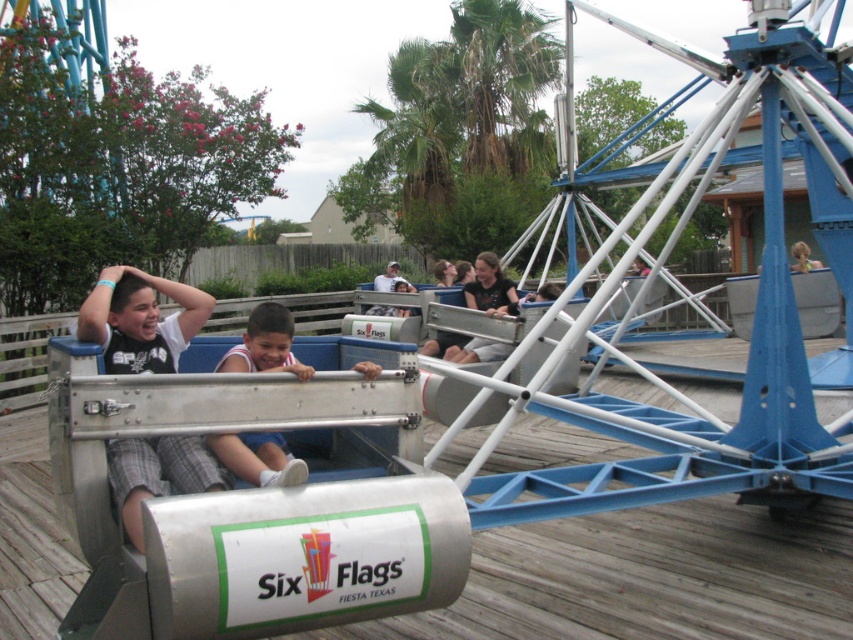
Is matte black shirt at left bigger than white jersey at center?

No.

Between matte black shirt at left and white jersey at center, which one has less height?

white jersey at center

Between point (144, 323) and point (216, 454), which one is positioned in front?

Positioned in front is point (216, 454).

Locate an element on the screen. matte black shirt at left is located at coordinates (140, 321).